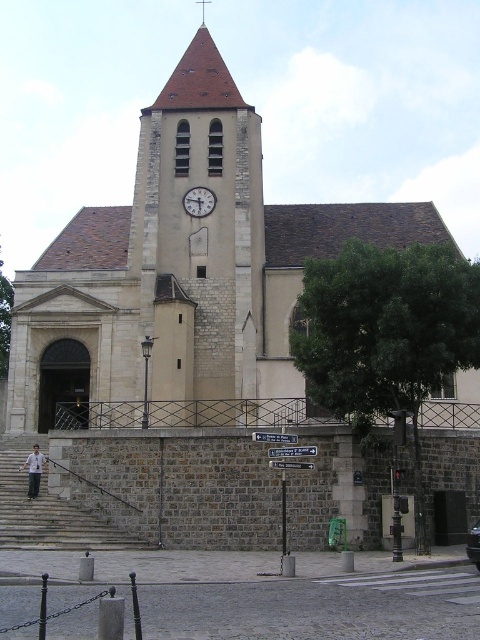
Consider the image. Does white glossy clock at center have a lesser width compared to smooth gold spire at upper center?

In fact, white glossy clock at center might be wider than smooth gold spire at upper center.

Can you confirm if white glossy clock at center is positioned above smooth gold spire at upper center?

Incorrect, white glossy clock at center is not positioned above smooth gold spire at upper center.

Is point (196, 188) positioned in front of point (204, 24)?

Yes, point (196, 188) is in front of point (204, 24).

The height and width of the screenshot is (640, 480). Find the location of `white glossy clock at center`. white glossy clock at center is located at coordinates (199, 202).

Does beige stone clock tower at center have a greater height compared to white glossy clock at center?

Correct, beige stone clock tower at center is much taller as white glossy clock at center.

Between beige stone clock tower at center and white glossy clock at center, which one has less height?

With less height is white glossy clock at center.

Who is more distant from viewer, (218, 204) or (210, 200)?

The point (210, 200) is more distant.

Identify the location of beige stone clock tower at center. (200, 232).

Which of these two, gray stone stairs at lower left or white glossy clock at center, stands taller?

gray stone stairs at lower left

Does gray stone stairs at lower left have a greater height compared to white glossy clock at center?

Indeed, gray stone stairs at lower left has a greater height compared to white glossy clock at center.

Locate an element on the screen. Image resolution: width=480 pixels, height=640 pixels. gray stone stairs at lower left is located at coordinates (48, 512).